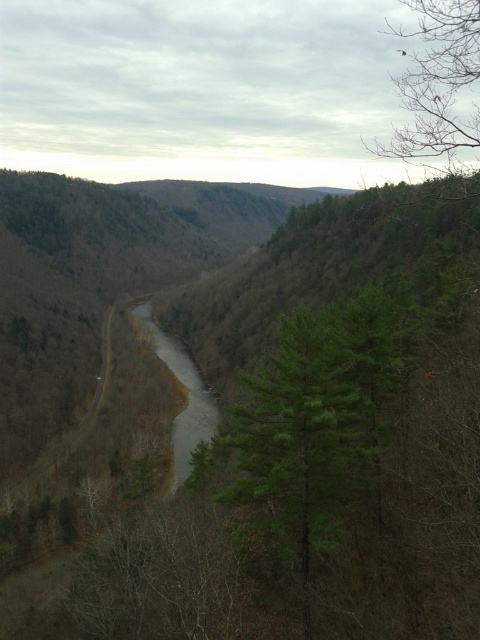
You are standing at the point with coordinates point (x=187, y=356) and want to reach the point with coordinates point (x=436, y=168). According to the image, which direction should you move to get closer to your destination?

You should move backward because point (x=436, y=168) is behind point (x=187, y=356) in the image.